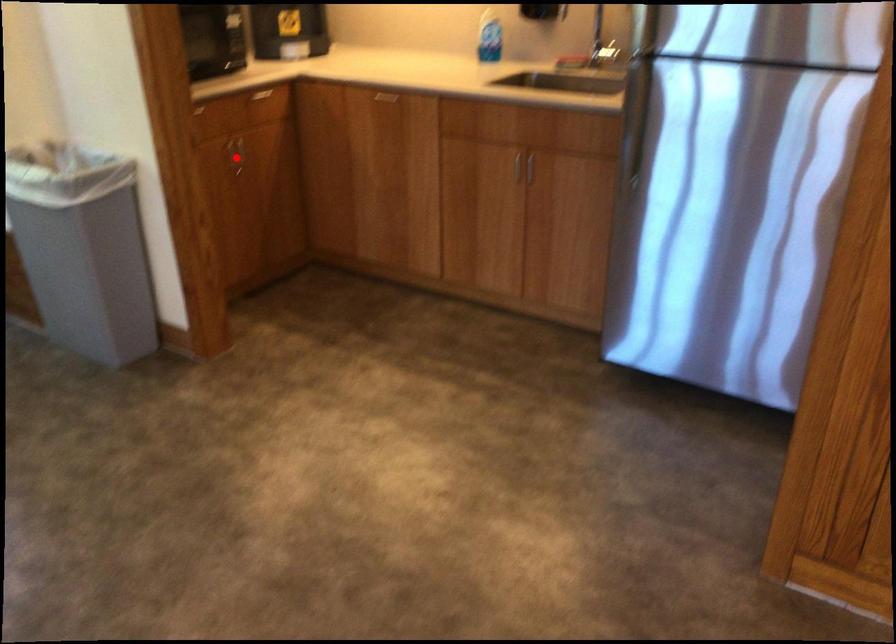
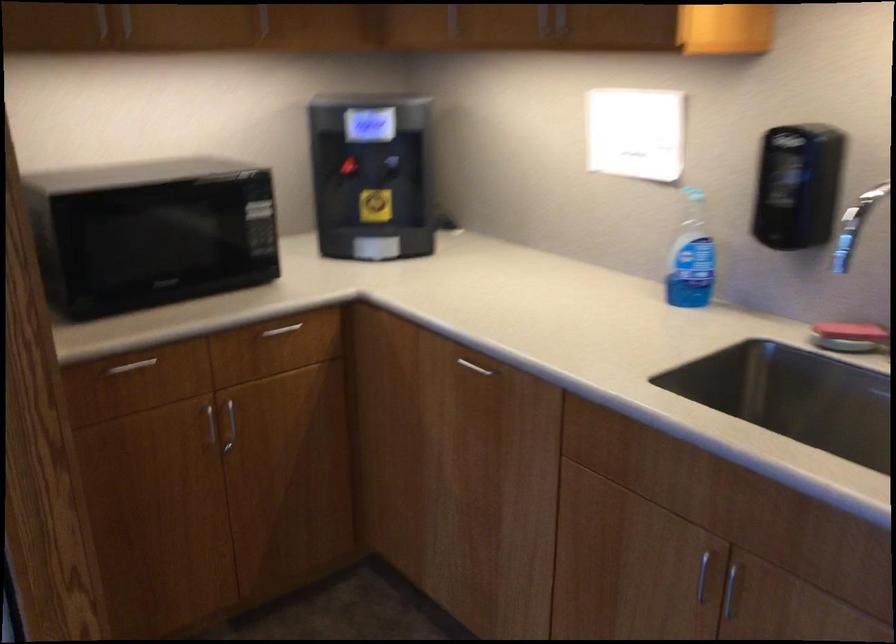
Locate, in the second image, the point that corresponds to the highlighted location in the first image.

(229, 426)